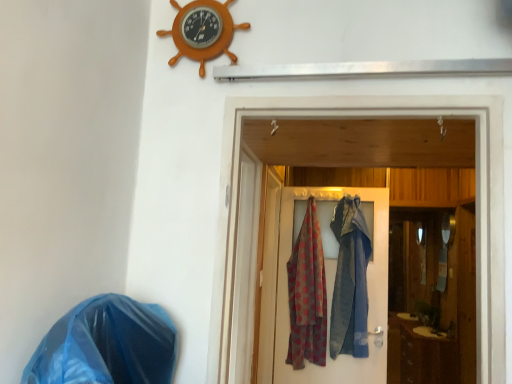
The image size is (512, 384). I want to click on blue plastic bag at lower left, so click(x=106, y=345).

This screenshot has height=384, width=512. Describe the element at coordinates (368, 295) in the screenshot. I see `polka dot fabric at center, positioned as the first door in back-to-front order` at that location.

Locate an element on the screen. blue plastic bag at lower left is located at coordinates (106, 345).

Is polka dot fabric at center positioned behind orange wood ship wheel at upper center?

Yes, polka dot fabric at center is further from the viewer.

Which point is more forward, [311,201] or [204,9]?

The point [204,9] is more forward.

Is polka dot fabric at center aimed at orange wood ship wheel at upper center?

Yes, polka dot fabric at center is oriented towards orange wood ship wheel at upper center.

Between polka dot fabric at center and orange wood ship wheel at upper center, which one appears on the right side from the viewer's perspective?

From the viewer's perspective, polka dot fabric at center appears more on the right side.

Does wooden door at center, the 1th door in the front-to-back sequence, contain orange wood ship wheel at upper center?

No.

Is wooden door at center, which is the 2th door in back-to-front order, facing away from orange wood ship wheel at upper center?

wooden door at center, which is the 2th door in back-to-front order, is not turned away from orange wood ship wheel at upper center.

Is wooden door at center, which is the 2th door in back-to-front order, far from orange wood ship wheel at upper center?

wooden door at center, which is the 2th door in back-to-front order, is near orange wood ship wheel at upper center, not far away.

Would you say orange wood ship wheel at upper center is a long distance from polka dot fabric at center, positioned as the first door in back-to-front order?

Yes, orange wood ship wheel at upper center is far from polka dot fabric at center, positioned as the first door in back-to-front order.

Locate an element on the screen. Image resolution: width=512 pixels, height=384 pixels. door behind the orange wood ship wheel at upper center is located at coordinates pyautogui.click(x=368, y=295).

Is orange wood ship wheel at upper center facing towards polka dot fabric at center, positioned as the first door in back-to-front order?

No.

Is polka dot fabric at center looking in the opposite direction of wooden door at center, which is the 2th door in back-to-front order?

No, polka dot fabric at center's orientation is not away from wooden door at center, which is the 2th door in back-to-front order.

Does polka dot fabric at center have a greater height compared to wooden door at center, the 1th door in the front-to-back sequence?

Indeed, polka dot fabric at center has a greater height compared to wooden door at center, the 1th door in the front-to-back sequence.

In the scene shown: Is polka dot fabric at center wider than wooden door at center, the 1th door in the front-to-back sequence?

Indeed, polka dot fabric at center has a greater width compared to wooden door at center, the 1th door in the front-to-back sequence.

How much distance is there between polka dot fabric at center and wooden door at center, which is the 2th door in back-to-front order?

The distance of polka dot fabric at center from wooden door at center, which is the 2th door in back-to-front order, is 1.55 meters.

Is orange wood ship wheel at upper center with polka dot fabric at center?

No, orange wood ship wheel at upper center is not in contact with polka dot fabric at center.

Considering the points (181, 23) and (297, 327), which point is in front, point (181, 23) or point (297, 327)?

The point (181, 23) is more forward.

Is orange wood ship wheel at upper center facing away from polka dot fabric at center?

orange wood ship wheel at upper center does not have its back to polka dot fabric at center.

From the picture: From a real-world perspective, which object stands above the other?

orange wood ship wheel at upper center is physically above.

The height and width of the screenshot is (384, 512). In order to click on clock above the polka dot fabric at center, positioned as the first door in back-to-front order (from a real-world perspective) in this screenshot , I will do (x=202, y=31).

Does polka dot fabric at center, positioned as the first door in back-to-front order, have a smaller size compared to orange wood ship wheel at upper center?

No.

From the image's perspective, which object appears higher, polka dot fabric at center, which ranks as the 2th door in front-to-back order, or orange wood ship wheel at upper center?

orange wood ship wheel at upper center is shown above in the image.

From a real-world perspective, who is located lower, blue plastic bag at lower left or polka dot fabric at center, positioned as the first door in back-to-front order?

From a 3D spatial view, blue plastic bag at lower left is below.

Is blue plastic bag at lower left far away from polka dot fabric at center, which ranks as the 2th door in front-to-back order?

blue plastic bag at lower left is far away from polka dot fabric at center, which ranks as the 2th door in front-to-back order.

This screenshot has height=384, width=512. What are the coordinates of `clothing located on the right of orange wood ship wheel at upper center` in the screenshot? It's located at (307, 294).

Identify the location of clock located on the left of wooden door at center, which is the 2th door in back-to-front order. This screenshot has width=512, height=384. (202, 31).

Estimate the real-world distances between objects in this image. Which object is closer to polka dot fabric at center, polka dot fabric at center, positioned as the first door in back-to-front order, or blue plastic bag at lower left?

polka dot fabric at center, positioned as the first door in back-to-front order.

Looking at the image, which one is located closer to wooden door at center, which is the 2th door in back-to-front order, polka dot fabric at center, which ranks as the 2th door in front-to-back order, or blue plastic bag at lower left?

Based on the image, blue plastic bag at lower left appears to be nearer to wooden door at center, which is the 2th door in back-to-front order.

Estimate the real-world distances between objects in this image. Which object is closer to wooden door at center, the 1th door in the front-to-back sequence, polka dot fabric at center or polka dot fabric at center, positioned as the first door in back-to-front order?

polka dot fabric at center.

When comparing their distances from orange wood ship wheel at upper center, does blue plastic bag at lower left or polka dot fabric at center, which ranks as the 2th door in front-to-back order, seem further?

polka dot fabric at center, which ranks as the 2th door in front-to-back order.

Which object lies nearer to the anchor point wooden door at center, the 1th door in the front-to-back sequence, orange wood ship wheel at upper center or blue plastic bag at lower left?

orange wood ship wheel at upper center is positioned closer to the anchor wooden door at center, the 1th door in the front-to-back sequence.

Estimate the real-world distances between objects in this image. Which object is further from blue plastic bag at lower left, polka dot fabric at center, which ranks as the 2th door in front-to-back order, or polka dot fabric at center?

Among the two, polka dot fabric at center, which ranks as the 2th door in front-to-back order, is located further to blue plastic bag at lower left.

Considering their positions, is polka dot fabric at center, positioned as the first door in back-to-front order, positioned closer to blue plastic bag at lower left than wooden door at center, the 1th door in the front-to-back sequence?

Based on the image, wooden door at center, the 1th door in the front-to-back sequence, appears to be nearer to blue plastic bag at lower left.

Based on their spatial positions, is polka dot fabric at center or blue plastic bag at lower left further from orange wood ship wheel at upper center?

polka dot fabric at center lies further to orange wood ship wheel at upper center than the other object.

The height and width of the screenshot is (384, 512). What are the coordinates of `door positioned between orange wood ship wheel at upper center and polka dot fabric at center from near to far` in the screenshot? It's located at (368, 295).

Locate an element on the screen. The width and height of the screenshot is (512, 384). door between wooden door at center, the 1th door in the front-to-back sequence, and polka dot fabric at center, along the z-axis is located at coordinates (368, 295).

At what (x,y) coordinates should I click in order to perform the action: click on door between blue plastic bag at lower left and polka dot fabric at center, positioned as the first door in back-to-front order, along the z-axis. Please return your answer as a coordinate pair (x, y). The width and height of the screenshot is (512, 384). Looking at the image, I should click on (394, 116).

Where is `clock located between wooden door at center, which is the 2th door in back-to-front order, and polka dot fabric at center, which ranks as the 2th door in front-to-back order, in the depth direction`? This screenshot has width=512, height=384. clock located between wooden door at center, which is the 2th door in back-to-front order, and polka dot fabric at center, which ranks as the 2th door in front-to-back order, in the depth direction is located at coordinates (202, 31).